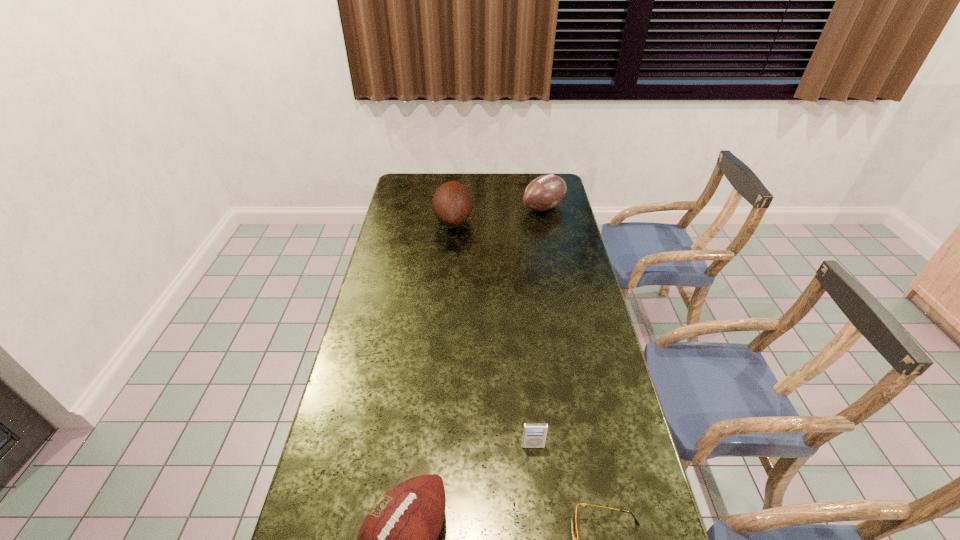
This screenshot has width=960, height=540. In the image, there is a desktop. Identify the location of blank space at the right edge. (581, 251).

The height and width of the screenshot is (540, 960). What are the coordinates of `vacant space at the far left corner` in the screenshot? It's located at (423, 179).

Where is `free spot between the rightmost football (American) and the iPod`? The width and height of the screenshot is (960, 540). free spot between the rightmost football (American) and the iPod is located at coordinates (539, 327).

This screenshot has width=960, height=540. In order to click on unoccupied area between the third object from right to left and the rightmost football (American) in this screenshot , I will do `click(539, 327)`.

Locate an element on the screen. This screenshot has height=540, width=960. object that is the fourth closest to the nearest football (American) is located at coordinates (545, 192).

This screenshot has width=960, height=540. I want to click on object that is the closest one to the sunglasses, so click(534, 434).

The width and height of the screenshot is (960, 540). I want to click on football (American) identified as the closest to the rightmost football (American), so click(452, 205).

Point out which football (American) is positioned as the nearest to the nearest football (American). Please provide its 2D coordinates. Your answer should be formatted as a tuple, i.e. [(x, y)], where the tuple contains the x and y coordinates of a point satisfying the conditions above.

[(452, 205)]